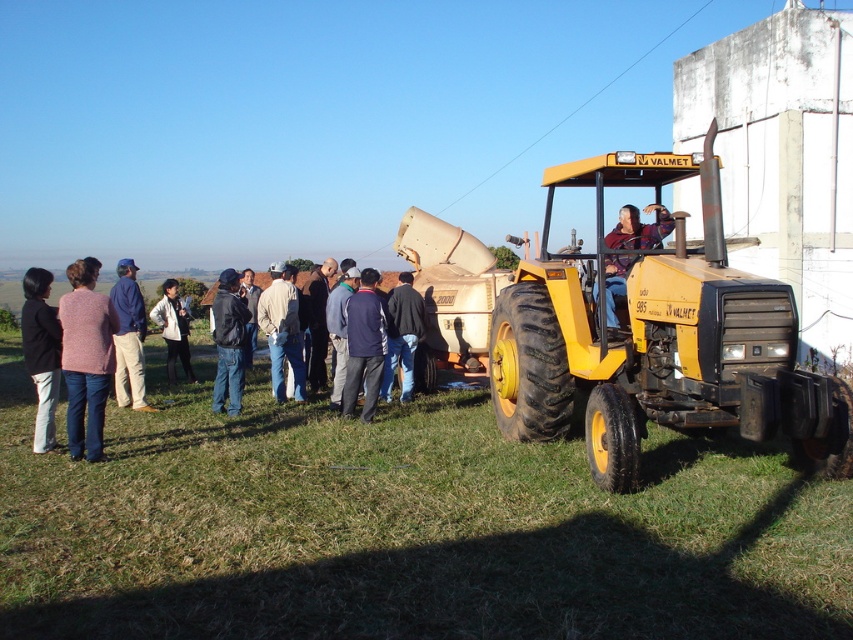
What do you see at coordinates (86, 356) in the screenshot? I see `knitted pink sweater at left` at bounding box center [86, 356].

Between knitted pink sweater at left and plaid fabric shirt at center, which one has less height?

Standing shorter between the two is plaid fabric shirt at center.

Is point (80, 316) positioned before point (606, 294)?

Yes, it is in front of point (606, 294).

Locate an element on the screen. knitted pink sweater at left is located at coordinates (86, 356).

Who is positioned more to the right, yellow matte tractor at right or navy blue jacket at center?

Positioned to the right is yellow matte tractor at right.

Can you confirm if yellow matte tractor at right is smaller than navy blue jacket at center?

No.

Between point (816, 454) and point (363, 340), which one is positioned in front?

Point (816, 454) is in front.

Locate an element on the screen. Image resolution: width=853 pixels, height=640 pixels. yellow matte tractor at right is located at coordinates (630, 330).

Is dark blue jeans at center above dark blue fabric jacket at center?

No, dark blue jeans at center is not above dark blue fabric jacket at center.

Where is `dark blue jeans at center`? This screenshot has width=853, height=640. dark blue jeans at center is located at coordinates (229, 342).